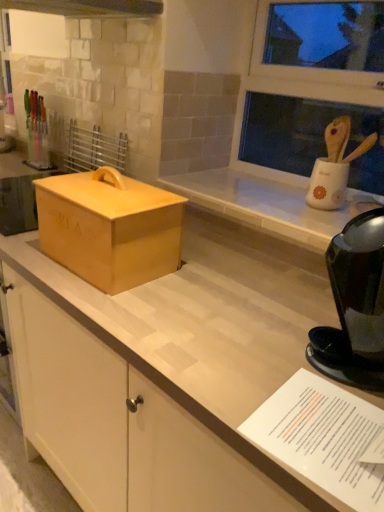
Question: From the image's perspective, is matte yellow box at center located above or below black glossy coffee maker at right?

Choices:
 (A) below
 (B) above

Answer: (B)

Question: Is matte yellow box at center taller or shorter than black glossy coffee maker at right?

Choices:
 (A) short
 (B) tall

Answer: (A)

Question: Considering the real-world distances, which object is farthest from the matte yellow box at center?

Choices:
 (A) black glossy coffee maker at right
 (B) white paper at lower right

Answer: (B)

Question: Which is farther from the black glossy coffee maker at right?

Choices:
 (A) white paper at lower right
 (B) matte yellow box at center

Answer: (B)